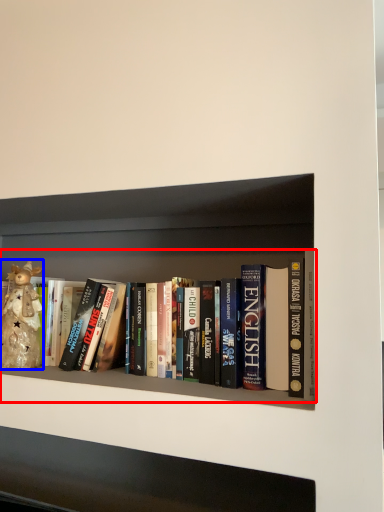
Question: Which point is further to the camera, book (highlighted by a red box) or toy (highlighted by a blue box)?

Choices:
 (A) book
 (B) toy

Answer: (B)